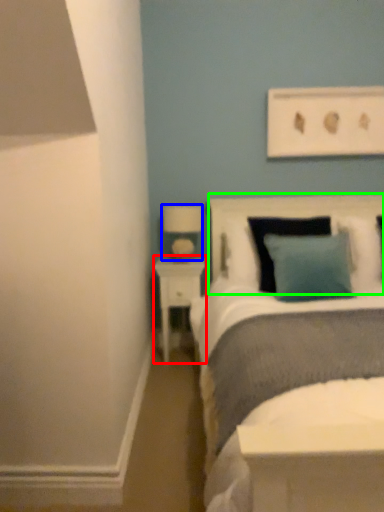
Question: Which object is positioned closest to nightstand (highlighted by a red box)? Select from lamp (highlighted by a blue box) and headboard (highlighted by a green box).

Choices:
 (A) lamp
 (B) headboard

Answer: (A)